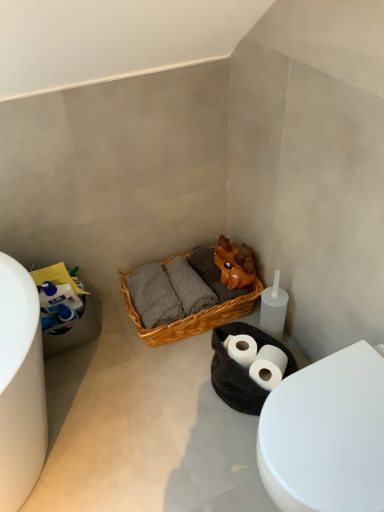
Measure the distance between point (341,502) and camera.

Point (341,502) is 33.54 inches away from camera.

I want to click on white matte toilet paper at lower left, so click(x=59, y=297).

Locate an element on the screen. The image size is (384, 512). white glossy toilet at lower right is located at coordinates (326, 435).

In terms of width, does white glossy toilet at lower right look wider or thinner when compared to woven wood picnic basket at center?

Clearly, white glossy toilet at lower right has less width compared to woven wood picnic basket at center.

Which is more to the left, white glossy toilet at lower right or woven wood picnic basket at center?

From the viewer's perspective, woven wood picnic basket at center appears more on the left side.

How distant is white glossy toilet at lower right from woven wood picnic basket at center?

white glossy toilet at lower right is 30.51 inches away from woven wood picnic basket at center.

How different are the orientations of white glossy toilet at lower right and woven wood picnic basket at center in degrees?

2.66 degrees separate the facing orientations of white glossy toilet at lower right and woven wood picnic basket at center.

Which object is further away from the camera, woven wood picnic basket at center or white matte toilet paper at lower left?

woven wood picnic basket at center is further from the camera.

Based on the photo, from a real-world perspective, is woven wood picnic basket at center located beneath white matte toilet paper at lower left?

Yes, from a real-world perspective, woven wood picnic basket at center is under white matte toilet paper at lower left.

Which is correct: woven wood picnic basket at center is inside white matte toilet paper at lower left, or outside of it?

woven wood picnic basket at center is located beyond the bounds of white matte toilet paper at lower left.

Where is `picnic basket beneath the white matte toilet paper at lower left (from a real-world perspective)`? The height and width of the screenshot is (512, 384). picnic basket beneath the white matte toilet paper at lower left (from a real-world perspective) is located at coordinates (192, 315).

Can you tell me how much white matte toilet paper at lower left and woven wood picnic basket at center differ in facing direction?

They differ by 90.4 degrees in their facing directions.

Is point (55, 303) positioned behind point (151, 337)?

That is False.

From a real-world perspective, who is located higher, white matte toilet paper at lower left or woven wood picnic basket at center?

white matte toilet paper at lower left.

Between white matte toilet paper at lower left and woven wood picnic basket at center, which one has larger size?

woven wood picnic basket at center.

Between woven wood picnic basket at center and white glossy toilet at lower right, which one is positioned behind?

Positioned behind is woven wood picnic basket at center.

Considering the points (157, 327) and (286, 417), which point is behind, point (157, 327) or point (286, 417)?

Point (157, 327)

Measure the distance from woven wood picnic basket at center to white glossy toilet at lower right.

woven wood picnic basket at center is 30.51 inches away from white glossy toilet at lower right.

Considering the relative sizes of woven wood picnic basket at center and white glossy toilet at lower right in the image provided, is woven wood picnic basket at center bigger than white glossy toilet at lower right?

No.

Is white glossy toilet at lower right beside white matte toilet paper at lower left?

No, white glossy toilet at lower right is not beside white matte toilet paper at lower left.

Is white glossy toilet at lower right facing towards white matte toilet paper at lower left?

No.

From a real-world perspective, does white glossy toilet at lower right stand above white matte toilet paper at lower left?

Incorrect, from a real-world perspective, white glossy toilet at lower right is lower than white matte toilet paper at lower left.

In the scene shown: Measure the distance between white glossy toilet at lower right and white matte toilet paper at lower left.

They are 38.73 inches apart.

Is white matte toilet paper at lower left positioned before white glossy toilet at lower right?

No, white matte toilet paper at lower left is further to the viewer.

In the scene shown: Can you confirm if white matte toilet paper at lower left is thinner than white glossy toilet at lower right?

Yes.

Is point (53, 331) positioned after point (295, 398)?

Yes, it is behind point (295, 398).

Where is `picnic basket below the white glossy toilet at lower right (from a real-world perspective)`? picnic basket below the white glossy toilet at lower right (from a real-world perspective) is located at coordinates pos(192,315).

Locate an element on the screen. picnic basket below the white matte toilet paper at lower left (from the image's perspective) is located at coordinates (192, 315).

Based on their spatial positions, is white glossy toilet at lower right or white matte toilet paper at lower left further from woven wood picnic basket at center?

white glossy toilet at lower right lies further to woven wood picnic basket at center than the other object.

Considering their positions, is woven wood picnic basket at center positioned further to white glossy toilet at lower right than white matte toilet paper at lower left?

white matte toilet paper at lower left is positioned further to the anchor white glossy toilet at lower right.

When comparing their distances from woven wood picnic basket at center, does white matte toilet paper at lower left or white glossy toilet at lower right seem closer?

Based on the image, white matte toilet paper at lower left appears to be nearer to woven wood picnic basket at center.

Looking at the image, which one is located closer to white matte toilet paper at lower left, white glossy toilet at lower right or woven wood picnic basket at center?

woven wood picnic basket at center.

From the image, which object appears to be farther from white glossy toilet at lower right, white matte toilet paper at lower left or woven wood picnic basket at center?

The object further to white glossy toilet at lower right is white matte toilet paper at lower left.

Which object lies nearer to the anchor point white matte toilet paper at lower left, woven wood picnic basket at center or white glossy toilet at lower right?

woven wood picnic basket at center is positioned closer to the anchor white matte toilet paper at lower left.

Image resolution: width=384 pixels, height=512 pixels. In order to click on picnic basket located between white matte toilet paper at lower left and white glossy toilet at lower right in the left-right direction in this screenshot , I will do `click(192, 315)`.